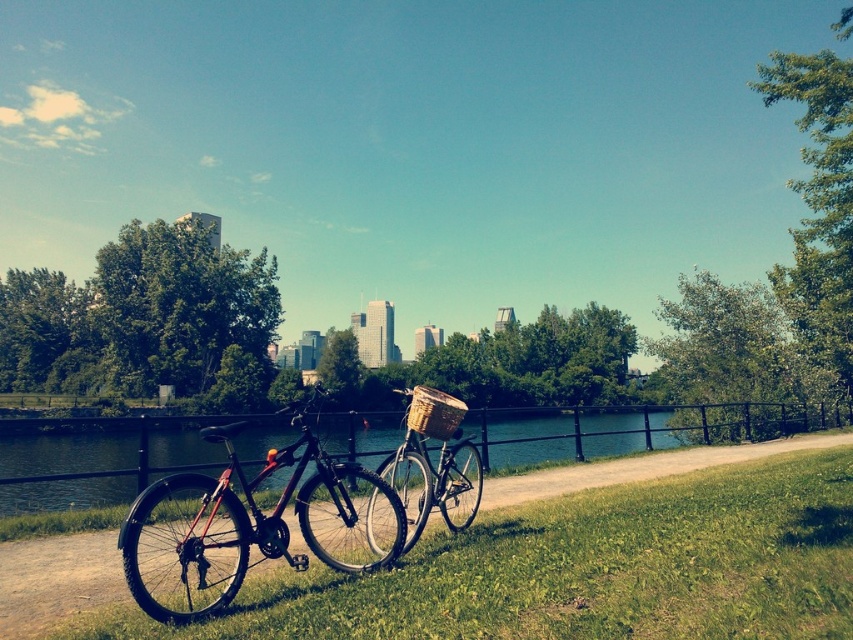
You are standing at the center of the grassy area and want to avoid stepping into the green water at lower left. Which direction should you move to stay away from it?

The green water at lower left is located at point (67, 452), so you should move away from the lower left direction to avoid stepping into it.